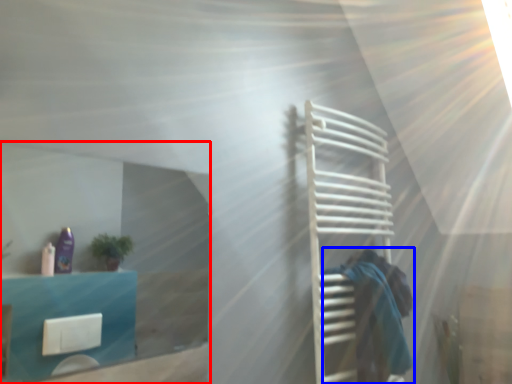
Question: Which point is closer to the camera, glass door (highlighted by a red box) or person (highlighted by a blue box)?

Choices:
 (A) glass door
 (B) person

Answer: (A)